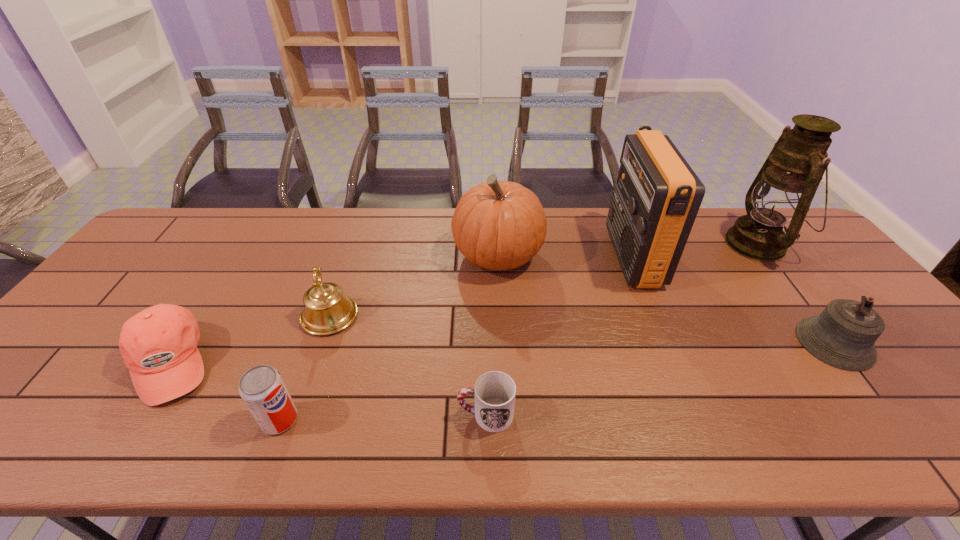
The image size is (960, 540). Identify the location of object that is at the far right corner. (784, 188).

You are a GUI agent. You are given a task and a screenshot of the screen. Output one action in this format:
    pyautogui.click(x=<x>, y=<y>)
    Task: Click on the free space at the far edge
    
    Given the screenshot: What is the action you would take?
    pyautogui.click(x=323, y=248)

Identify the location of free spot at the near edge of the desktop. (390, 422).

Find the location of `free region at the left edge of the desktop`. free region at the left edge of the desktop is located at coordinates (43, 366).

Identify the location of free space at the far right corner of the desktop. (812, 240).

Where is `vacant area between the sixth object from left to right and the tallest object`? The width and height of the screenshot is (960, 540). vacant area between the sixth object from left to right and the tallest object is located at coordinates (695, 251).

Where is `empty location between the oil lamp and the baseball cap`? The image size is (960, 540). empty location between the oil lamp and the baseball cap is located at coordinates (464, 303).

At what (x,y) coordinates should I click in order to perform the action: click on free space between the third tallest object and the cup. Please return your answer as a coordinate pair (x, y). The image size is (960, 540). Looking at the image, I should click on (492, 335).

Where is `free point between the soda and the right bell`? Image resolution: width=960 pixels, height=540 pixels. free point between the soda and the right bell is located at coordinates (557, 381).

Identify the location of free point between the tallest object and the sixth object from left to right. (695, 251).